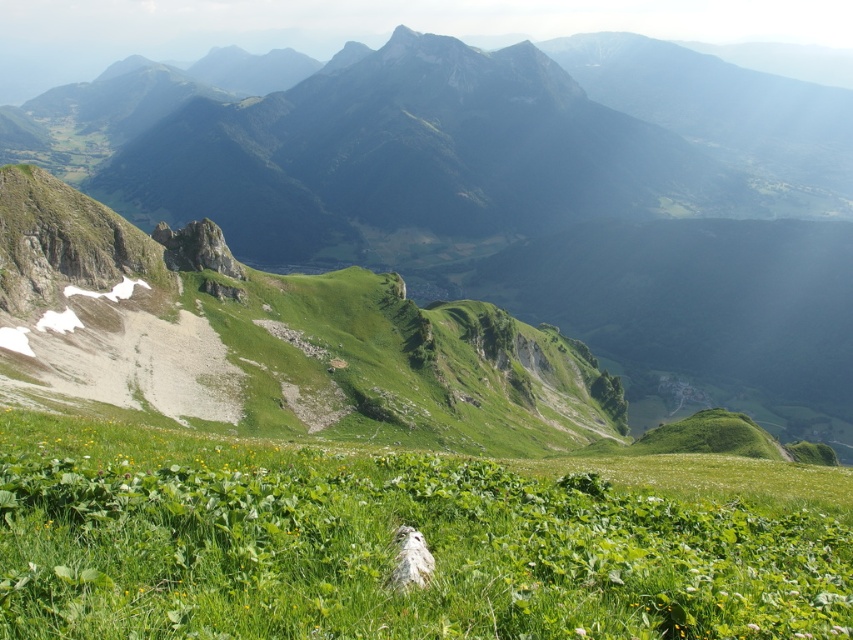
Based on the scene description, which object has a greater width between the green grassy mountain range at center and the green leafy grass at center?

The green grassy mountain range at center has a greater width than the green leafy grass at center according to the description.

You are a hiker standing on the white rock in the meadow. You see the green grassy mountain range at center and the green leafy grass at center. Which one is bigger in size?

The green grassy mountain range at center is larger in size compared to the green leafy grass at center.

You are a hiker standing at the edge of the meadow. You see the green grassy mountain range at center and the green leafy grass at center. Which one is farther from you?

The green grassy mountain range at center is farther from you than the green leafy grass at center because it is 1244.81 feet away from it.